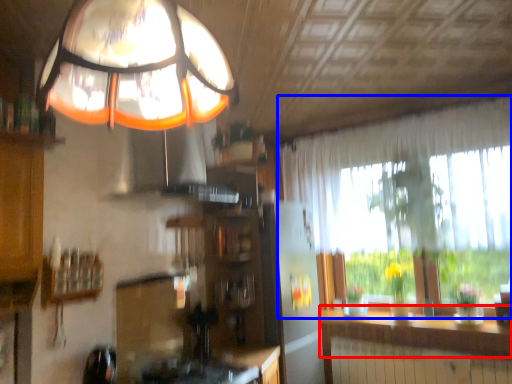
Question: Among these objects, which one is nearest to the camera, counter top (highlighted by a red box) or window (highlighted by a blue box)?

Choices:
 (A) counter top
 (B) window

Answer: (B)